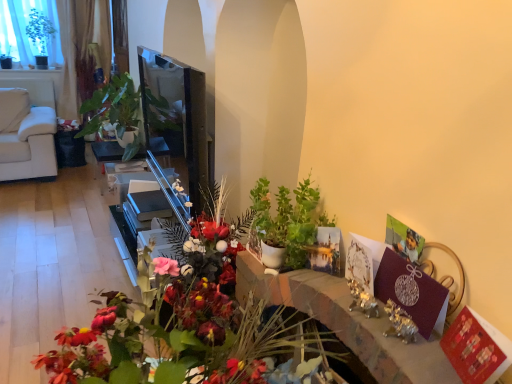
Question: Does matte floral arrangement at center have a greater height compared to green matte plant at center, placed as the 1th houseplant when sorted from front to back?

Choices:
 (A) no
 (B) yes

Answer: (B)

Question: Does matte floral arrangement at center come behind green matte plant at center, which is counted as the 2th houseplant, starting from the top?

Choices:
 (A) yes
 (B) no

Answer: (B)

Question: Are matte floral arrangement at center and green matte plant at center, placed as the first houseplant when sorted from right to left, located far from each other?

Choices:
 (A) yes
 (B) no

Answer: (B)

Question: Would you say green matte plant at center, acting as the first houseplant starting from the bottom, is part of matte floral arrangement at center's contents?

Choices:
 (A) no
 (B) yes

Answer: (A)

Question: From a real-world perspective, is matte floral arrangement at center located higher than green matte plant at center, positioned as the 2th houseplant in back-to-front order?

Choices:
 (A) no
 (B) yes

Answer: (A)

Question: Is matte floral arrangement at center aimed at green matte plant at center, placed as the 1th houseplant when sorted from front to back?

Choices:
 (A) no
 (B) yes

Answer: (A)

Question: Is green glossy plant at upper left, which is the 2th houseplant in bottom-to-top order, aimed at matte black table at center?

Choices:
 (A) yes
 (B) no

Answer: (B)

Question: From the image's perspective, does green glossy plant at upper left, positioned as the first houseplant in back-to-front order, appear lower than matte black table at center?

Choices:
 (A) yes
 (B) no

Answer: (B)

Question: From the image's perspective, is green glossy plant at upper left, which is the 2th houseplant in bottom-to-top order, on matte black table at center?

Choices:
 (A) yes
 (B) no

Answer: (A)

Question: Can you confirm if green glossy plant at upper left, marked as the second houseplant in a right-to-left arrangement, is shorter than matte black table at center?

Choices:
 (A) yes
 (B) no

Answer: (B)

Question: Considering the relative sizes of green glossy plant at upper left, positioned as the 1th houseplant in left-to-right order, and matte black table at center in the image provided, is green glossy plant at upper left, positioned as the 1th houseplant in left-to-right order, wider than matte black table at center?

Choices:
 (A) no
 (B) yes

Answer: (B)

Question: From a real-world perspective, is green glossy plant at upper left, marked as the second houseplant in a right-to-left arrangement, on top of matte black table at center?

Choices:
 (A) yes
 (B) no

Answer: (A)

Question: Is there a large distance between matte black table at center and green matte plant at center, acting as the first houseplant starting from the bottom?

Choices:
 (A) yes
 (B) no

Answer: (A)